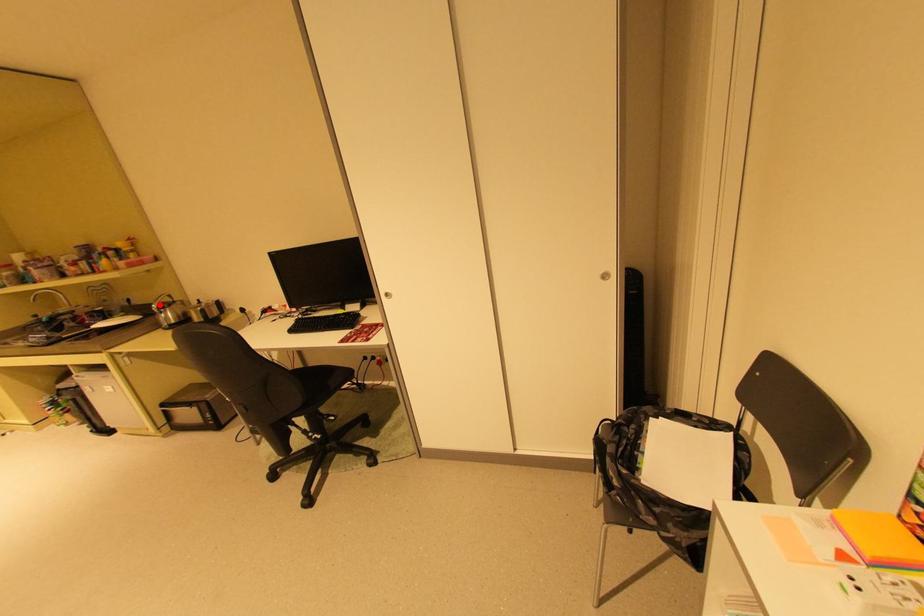
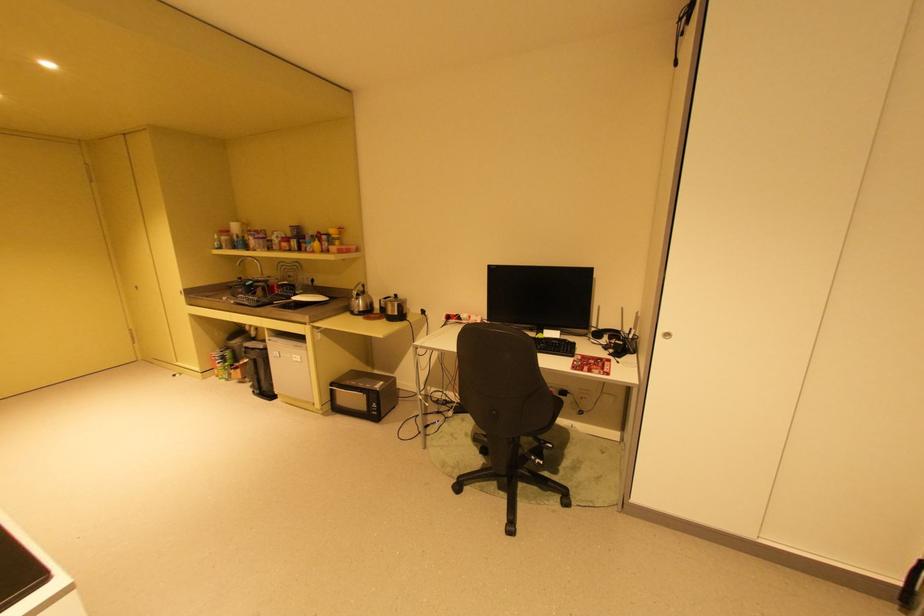
Question: I am providing you with two images of the same scene from different viewpoints. A red point is shown in image1. For the corresponding object point in image2, is it positioned nearer or farther from the camera?

Choices:
 (A) Nearer
 (B) Farther

Answer: (A)